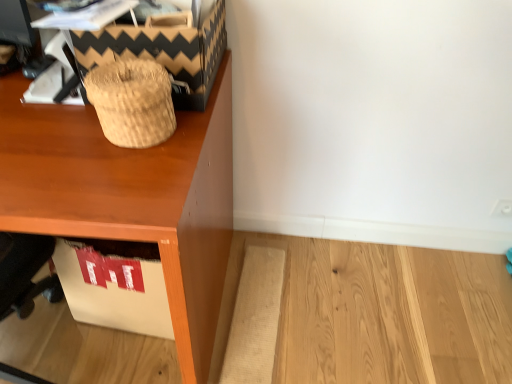
Question: From the image's perspective, is wooden desk at upper left on top of brown woven basket at upper left?

Choices:
 (A) no
 (B) yes

Answer: (A)

Question: Does wooden desk at upper left have a lesser height compared to brown woven basket at upper left?

Choices:
 (A) no
 (B) yes

Answer: (A)

Question: Can you confirm if wooden desk at upper left is bigger than brown woven basket at upper left?

Choices:
 (A) no
 (B) yes

Answer: (B)

Question: Could you tell me if wooden desk at upper left is turned towards brown woven basket at upper left?

Choices:
 (A) no
 (B) yes

Answer: (A)

Question: Is wooden desk at upper left not close to brown woven basket at upper left?

Choices:
 (A) yes
 (B) no

Answer: (B)

Question: From a real-world perspective, is wooden desk at upper left on top of brown woven basket at upper left?

Choices:
 (A) no
 (B) yes

Answer: (A)

Question: Could you tell me if woven straw basket at upper left is facing wooden desk at upper left?

Choices:
 (A) yes
 (B) no

Answer: (B)

Question: Does woven straw basket at upper left lie behind wooden desk at upper left?

Choices:
 (A) no
 (B) yes

Answer: (B)

Question: Is the surface of woven straw basket at upper left in direct contact with wooden desk at upper left?

Choices:
 (A) yes
 (B) no

Answer: (B)

Question: Can you confirm if woven straw basket at upper left is taller than wooden desk at upper left?

Choices:
 (A) yes
 (B) no

Answer: (B)

Question: Does woven straw basket at upper left have a greater width compared to wooden desk at upper left?

Choices:
 (A) no
 (B) yes

Answer: (A)

Question: Can you confirm if woven straw basket at upper left is thinner than wooden desk at upper left?

Choices:
 (A) no
 (B) yes

Answer: (B)

Question: From the image's perspective, is wooden desk at upper left located above woven straw basket at upper left?

Choices:
 (A) yes
 (B) no

Answer: (B)